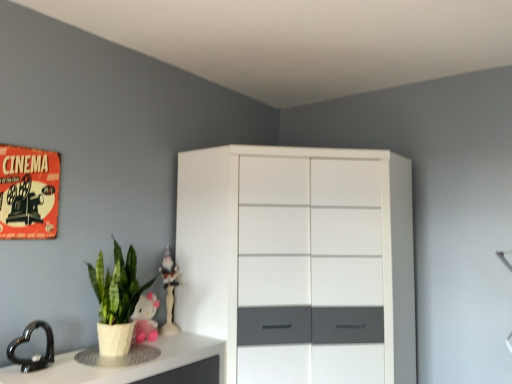
Where is `free space in front of black glossy heart at lower left`? The height and width of the screenshot is (384, 512). free space in front of black glossy heart at lower left is located at coordinates (24, 376).